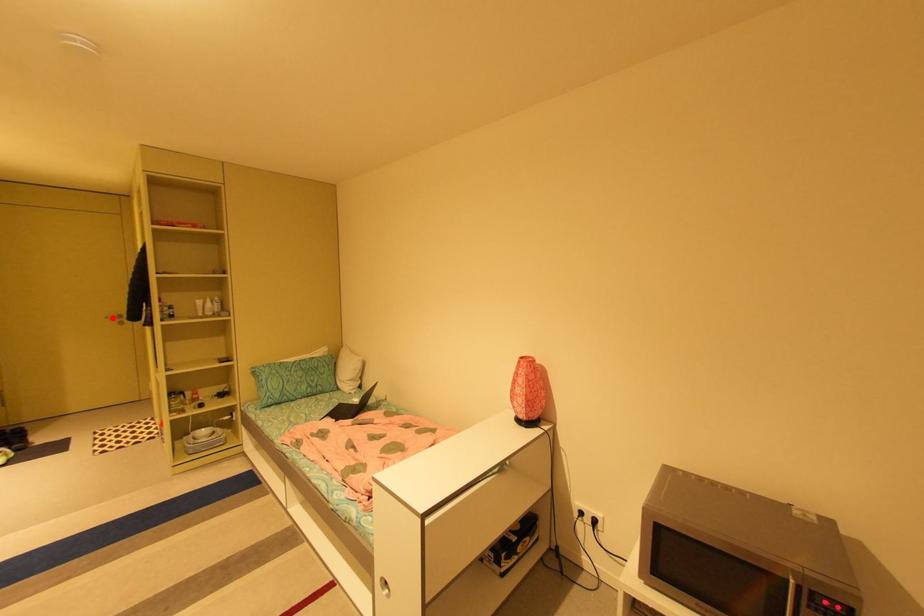
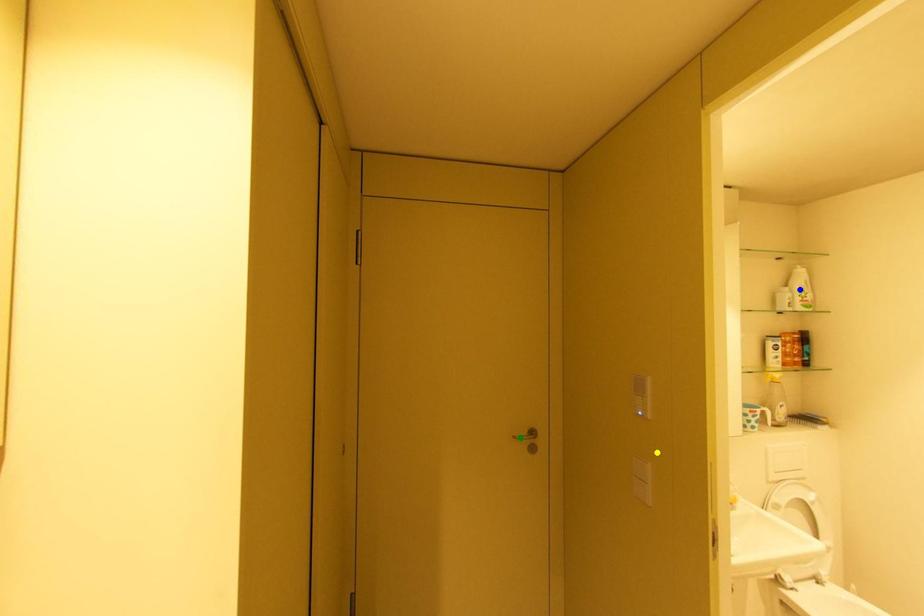
Question: I am providing you with two images of the same scene from different viewpoints. A red point is marked on the first image. You are given multiple points on the second image. Which point in image 2 is actually the same real-world point as the red point in image 1?

Choices:
 (A) green point
 (B) blue point
 (C) yellow point

Answer: (A)